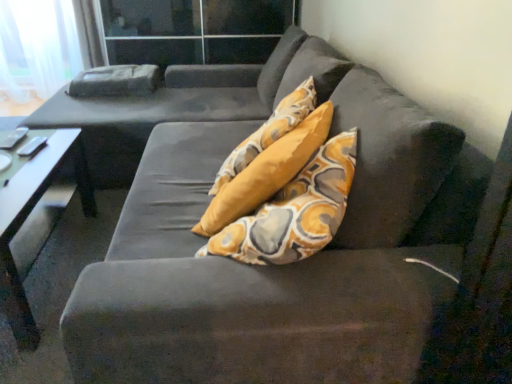
Question: Considering the relative positions of smooth white table at left and transparent glass door at upper center in the image provided, is smooth white table at left in front of transparent glass door at upper center?

Choices:
 (A) yes
 (B) no

Answer: (A)

Question: Considering the relative sizes of smooth white table at left and transparent glass door at upper center in the image provided, is smooth white table at left wider than transparent glass door at upper center?

Choices:
 (A) yes
 (B) no

Answer: (B)

Question: From a real-world perspective, is smooth white table at left located beneath transparent glass door at upper center?

Choices:
 (A) no
 (B) yes

Answer: (B)

Question: Does smooth white table at left have a lesser width compared to transparent glass door at upper center?

Choices:
 (A) yes
 (B) no

Answer: (A)

Question: Is smooth white table at left with transparent glass door at upper center?

Choices:
 (A) yes
 (B) no

Answer: (B)

Question: From a real-world perspective, is smooth white table at left on transparent glass door at upper center?

Choices:
 (A) yes
 (B) no

Answer: (B)

Question: From the image's perspective, is transparent glass door at upper center on top of smooth white table at left?

Choices:
 (A) no
 (B) yes

Answer: (B)

Question: Are transparent glass door at upper center and smooth white table at left making contact?

Choices:
 (A) no
 (B) yes

Answer: (A)

Question: Does transparent glass door at upper center appear on the left side of smooth white table at left?

Choices:
 (A) yes
 (B) no

Answer: (B)

Question: Considering the relative positions of transparent glass door at upper center and smooth white table at left in the image provided, is transparent glass door at upper center to the right of smooth white table at left from the viewer's perspective?

Choices:
 (A) no
 (B) yes

Answer: (B)

Question: Would you consider transparent glass door at upper center to be distant from smooth white table at left?

Choices:
 (A) yes
 (B) no

Answer: (A)

Question: Is transparent glass door at upper center looking in the opposite direction of smooth white table at left?

Choices:
 (A) no
 (B) yes

Answer: (A)

Question: Relative to smooth white table at left, is transparent glass door at upper center in front or behind?

Choices:
 (A) behind
 (B) front

Answer: (A)